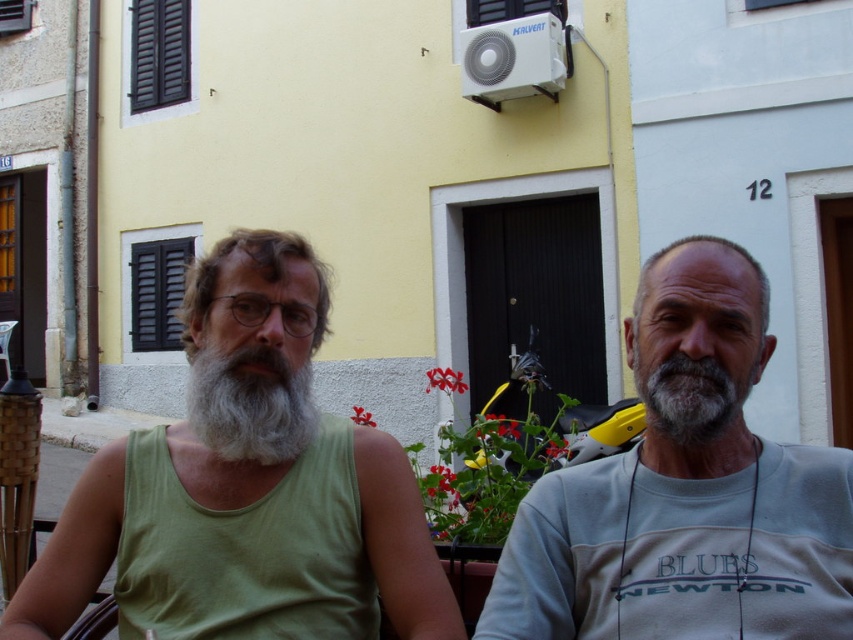
You are standing in front of the yellow building and want to approach the gray cotton shirt at right. What is the minimum distance you need to walk to reach it?

The minimum distance you need to walk to reach the gray cotton shirt at right is 1.53 meters.

You are a photographer standing in front of the building. You need to adjust the camera focus so that both the green fabric shirt at center and the graywoollybeard at left are in focus. Which object should you focus on to ensure both are sharp?

The green fabric shirt at center is taller than graywoollybeard at left. To ensure both are in focus, you should focus on the green fabric shirt at center since it is taller and farther away, allowing the depth of field to cover both subjects.